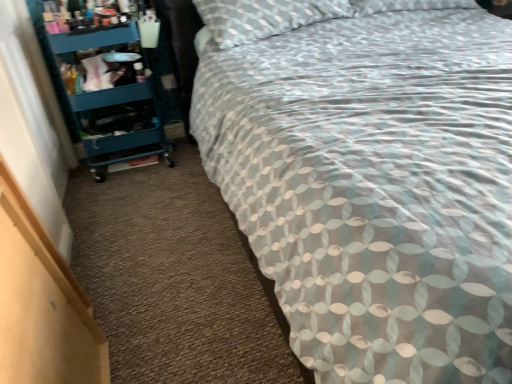
Where is `unoccupied area in front of teal plastic cart at left`? unoccupied area in front of teal plastic cart at left is located at coordinates (129, 193).